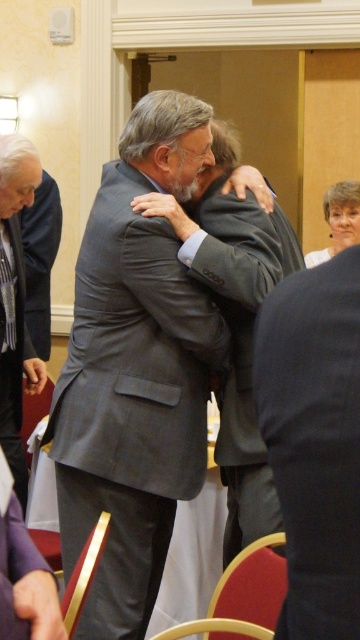
Does dark gray fabric business suit at center have a smaller size compared to gray wool business suit at center?

Yes, dark gray fabric business suit at center is smaller than gray wool business suit at center.

Can you confirm if dark gray fabric business suit at center is positioned to the left of gray wool business suit at center?

Indeed, dark gray fabric business suit at center is positioned on the left side of gray wool business suit at center.

Is point (326, 280) more distant than point (246, 220)?

No, it is in front of (246, 220).

You are a GUI agent. You are given a task and a screenshot of the screen. Output one action in this format:
    pyautogui.click(x=<x>, y=<y>)
    Task: Click on the dark gray fabric business suit at center
    This screenshot has width=360, height=640.
    Given the screenshot: What is the action you would take?
    pyautogui.click(x=315, y=440)

Which is above, gray wool business suit at center or gray wool suit at left?

Positioned higher is gray wool suit at left.

Identify the location of gray wool business suit at center. (241, 348).

Between point (196, 209) and point (18, 365), which one is positioned in front?

Point (196, 209) is in front.

Find the location of `gray wool business suit at center`. gray wool business suit at center is located at coordinates (241, 348).

Does point (293, 483) come in front of point (19, 342)?

Yes, it is in front of point (19, 342).

Does point (351, 355) come behind point (19, 321)?

That is False.

I want to click on dark gray fabric business suit at center, so click(315, 440).